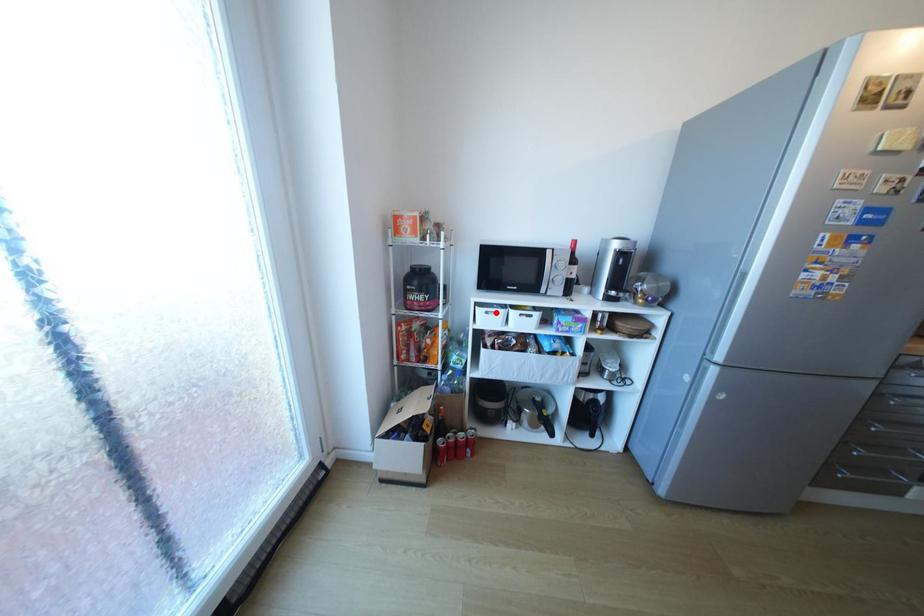
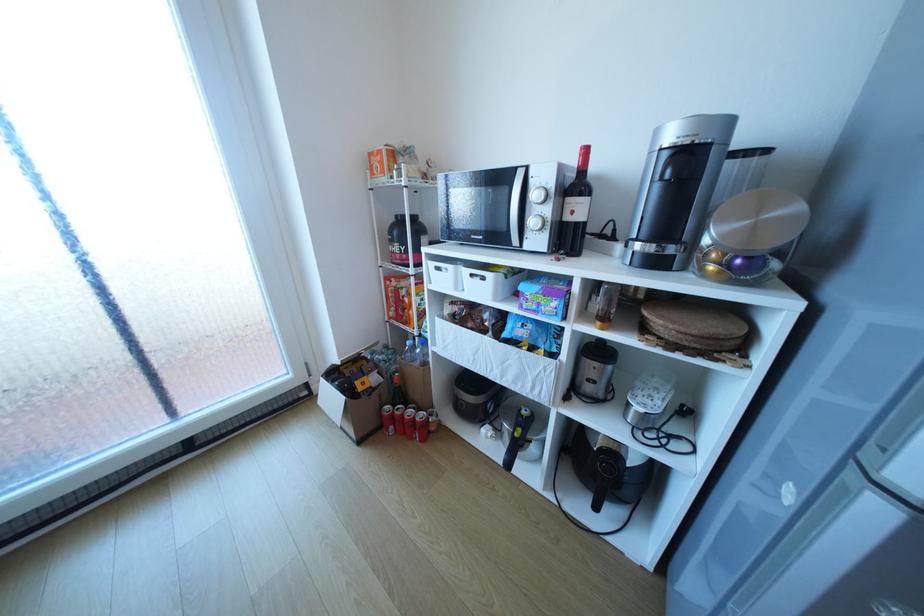
Question: I am providing you with two images of the same scene from different viewpoints. A red point is marked on the first image. Is the red point's position out of view in image 2?

Choices:
 (A) Yes
 (B) No

Answer: (B)